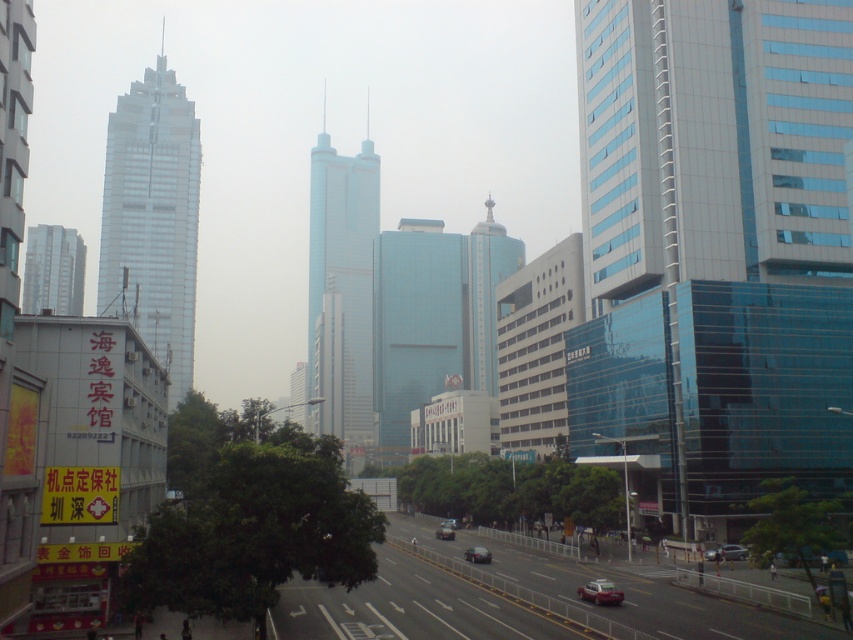
Who is higher up, silver metallic building at left or shiny black sedan at center?

silver metallic building at left is higher up.

Can you confirm if silver metallic building at left is positioned above shiny black sedan at center?

Indeed, silver metallic building at left is positioned over shiny black sedan at center.

Identify the location of silver metallic building at left. The height and width of the screenshot is (640, 853). (53, 269).

Identify the location of silver metallic building at left. Image resolution: width=853 pixels, height=640 pixels. click(x=53, y=269).

Which is below, smooth glass skyscraper at left or metallic silver car at lower right?

metallic silver car at lower right is below.

Is the position of smooth glass skyscraper at left more distant than that of metallic silver car at lower right?

Yes, smooth glass skyscraper at left is further from the viewer.

Is point (135, 305) farther from viewer compared to point (735, 556)?

Yes, point (135, 305) is behind point (735, 556).

Locate an element on the screen. This screenshot has height=640, width=853. smooth glass skyscraper at left is located at coordinates (152, 220).

Is smooth glass skyscraper at left wider than light blue glass skyscraper at center?

Yes, smooth glass skyscraper at left is wider than light blue glass skyscraper at center.

Can you confirm if smooth glass skyscraper at left is bigger than light blue glass skyscraper at center?

Indeed, smooth glass skyscraper at left has a larger size compared to light blue glass skyscraper at center.

Is point (166, 243) positioned after point (329, 371)?

No, (166, 243) is in front of (329, 371).

Find the location of a particular element. smooth glass skyscraper at left is located at coordinates click(152, 220).